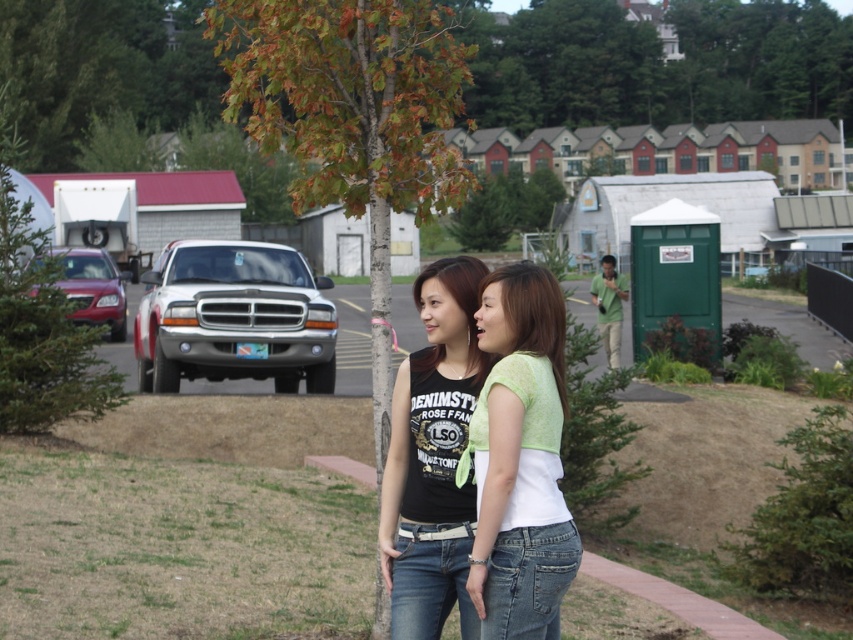
Who is more forward, [444,193] or [525,586]?

Point [525,586]

Does green leafy tree at center appear over green cotton shirt at center?

Indeed, green leafy tree at center is positioned over green cotton shirt at center.

Between point (259, 52) and point (556, 522), which one is positioned in front?

Point (556, 522)

Where is `green leafy tree at center`? green leafy tree at center is located at coordinates (352, 120).

Who is shorter, green cotton shirt at center or black matte tank top at center?

green cotton shirt at center is shorter.

Does point (550, 346) come in front of point (401, 362)?

Yes, it is.

The image size is (853, 640). Find the location of `green cotton shirt at center`. green cotton shirt at center is located at coordinates (520, 460).

Measure the distance between point (387, 184) and camera.

A distance of 5.84 meters exists between point (387, 184) and camera.

Is green leafy tree at center wider than black matte tank top at center?

Yes.

Between point (329, 145) and point (401, 608), which one is positioned in front?

Point (401, 608) is more forward.

Identify the location of green leafy tree at center. The image size is (853, 640). (352, 120).